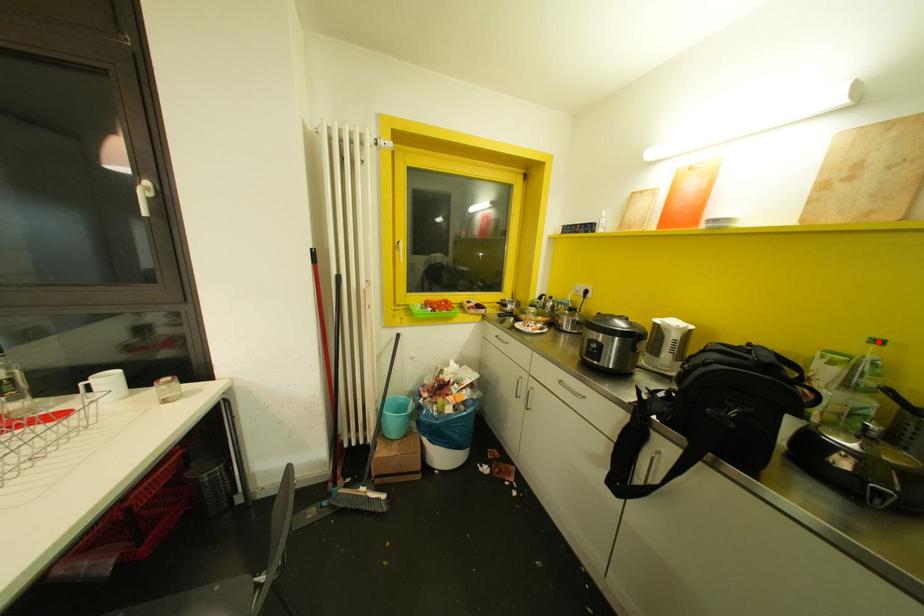
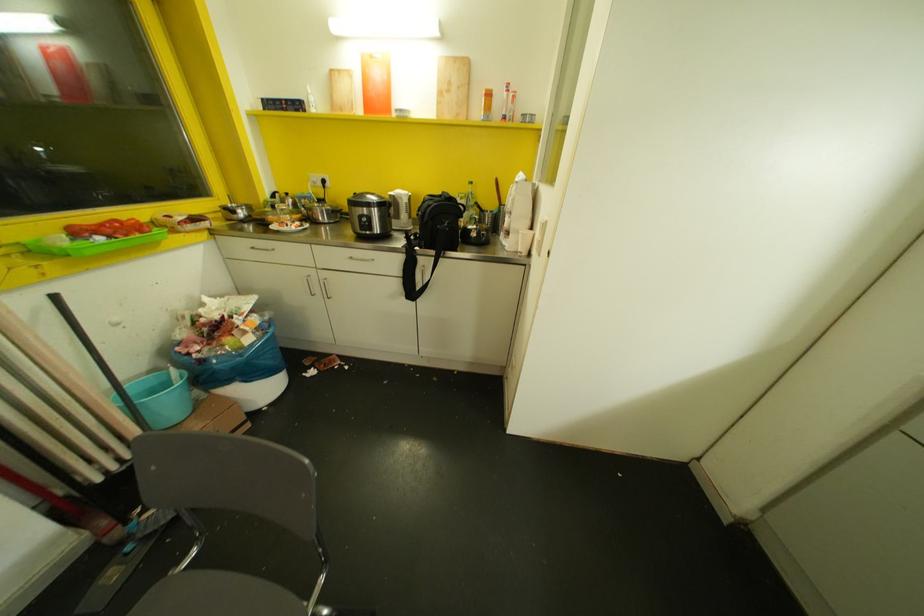
Question: I am providing you with two images of the same scene from different viewpoints. Image1 has a red point marked. In image2, the corresponding 3D location appears at what relative position? Reply with the corresponding letter.

Choices:
 (A) Closer
 (B) Farther

Answer: (A)